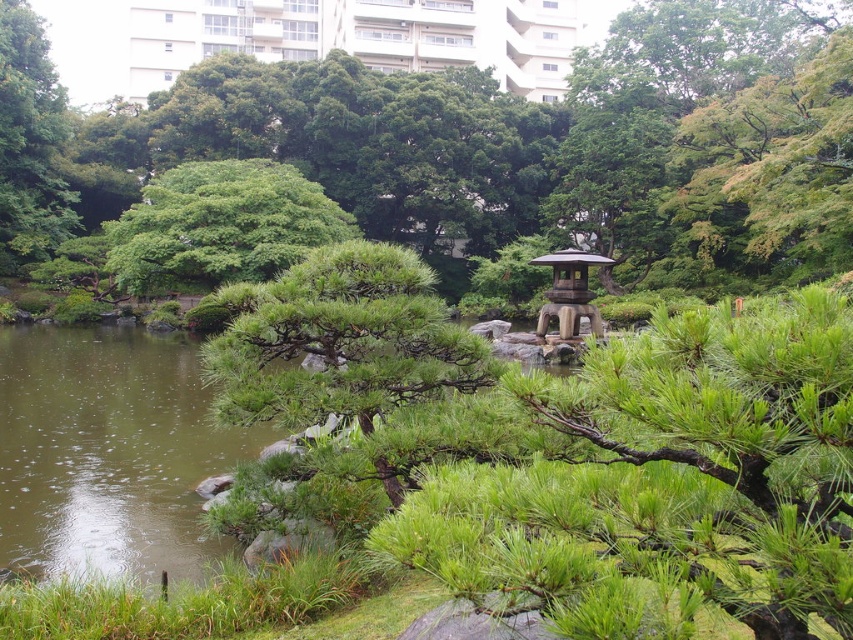
Question: Among these points, which one is farthest from the camera?

Choices:
 (A) (225, 243)
 (B) (457, 216)

Answer: (B)

Question: Is green leafy tree at center to the right of wooden lantern at center from the viewer's perspective?

Choices:
 (A) yes
 (B) no

Answer: (B)

Question: Among these objects, which one is farthest from the camera?

Choices:
 (A) wooden lantern at center
 (B) green matte tree at center

Answer: (B)

Question: Is green matte tree at center smaller than green leafy tree at center?

Choices:
 (A) no
 (B) yes

Answer: (A)

Question: Which point is farther to the camera?

Choices:
 (A) wooden lantern at center
 (B) green leafy tree at center
 (C) green matte tree at center

Answer: (B)

Question: Is green matte tree at center positioned in front of wooden lantern at center?

Choices:
 (A) yes
 (B) no

Answer: (B)